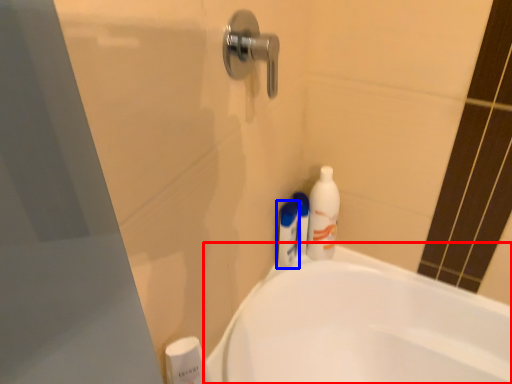
Question: Which object is further to the camera taking this photo, bathtub (highlighted by a red box) or toiletry (highlighted by a blue box)?

Choices:
 (A) bathtub
 (B) toiletry

Answer: (B)